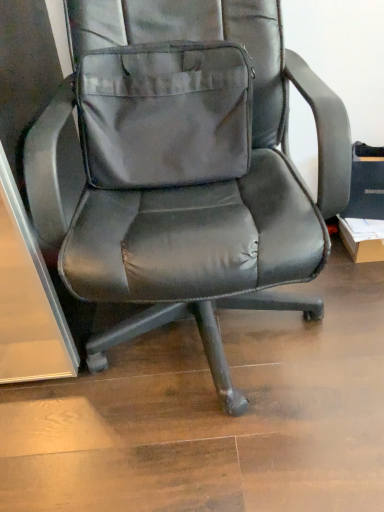
Describe the element at coordinates (165, 114) in the screenshot. I see `gray fabric pocket at center` at that location.

Find the location of a particular element. Image resolution: width=384 pixels, height=512 pixels. gray fabric pocket at center is located at coordinates (165, 114).

I want to click on black leather office chair at center, so click(186, 167).

What is the approximate height of black leather office chair at center?

88.19 centimeters.

The width and height of the screenshot is (384, 512). Describe the element at coordinates (186, 167) in the screenshot. I see `black leather office chair at center` at that location.

Measure the distance between black leather office chair at center and camera.

black leather office chair at center and camera are 31.15 inches apart from each other.

Image resolution: width=384 pixels, height=512 pixels. I want to click on gray fabric pocket at center, so click(x=165, y=114).

Between black leather office chair at center and gray fabric pocket at center, which one appears on the left side from the viewer's perspective?

gray fabric pocket at center is more to the left.

Between black leather office chair at center and gray fabric pocket at center, which one is positioned behind?

Positioned behind is gray fabric pocket at center.

Which is less distant, (185,8) or (166,144)?

Point (185,8) appears to be closer to the viewer than point (166,144).

From the image's perspective, is black leather office chair at center over gray fabric pocket at center?

Actually, black leather office chair at center appears below gray fabric pocket at center in the image.

From a real-world perspective, between black leather office chair at center and gray fabric pocket at center, who is vertically lower?

black leather office chair at center.

In the scene shown: Can you confirm if black leather office chair at center is wider than gray fabric pocket at center?

→ Correct, the width of black leather office chair at center exceeds that of gray fabric pocket at center.

From the picture: Is black leather office chair at center taller than gray fabric pocket at center?

Correct, black leather office chair at center is much taller as gray fabric pocket at center.

Looking at this image, is black leather office chair at center bigger or smaller than gray fabric pocket at center?

Considering their sizes, black leather office chair at center takes up more space than gray fabric pocket at center.

Is black leather office chair at center not inside gray fabric pocket at center?

That's correct, black leather office chair at center is outside of gray fabric pocket at center.

Is black leather office chair at center in contact with gray fabric pocket at center?

Indeed, black leather office chair at center and gray fabric pocket at center are beside each other and touching.

Is black leather office chair at center turned away from gray fabric pocket at center?

Correct, black leather office chair at center is looking away from gray fabric pocket at center.

How many degrees apart are the facing directions of black leather office chair at center and gray fabric pocket at center?

The facing directions of black leather office chair at center and gray fabric pocket at center are 0.00102 degrees apart.

How far apart are black leather office chair at center and gray fabric pocket at center?

black leather office chair at center and gray fabric pocket at center are 2.80 inches apart.

Locate an element on the screen. This screenshot has width=384, height=512. chair in front of the gray fabric pocket at center is located at coordinates (186, 167).

Considering the relative positions of gray fabric pocket at center and black leather office chair at center in the image provided, is gray fabric pocket at center to the right of black leather office chair at center from the viewer's perspective?

In fact, gray fabric pocket at center is to the left of black leather office chair at center.

Is the position of gray fabric pocket at center more distant than that of black leather office chair at center?

Yes.

Is point (105, 115) farther from camera compared to point (145, 169)?

No, it is in front of (145, 169).

From the image's perspective, is gray fabric pocket at center on black leather office chair at center?

Correct, gray fabric pocket at center appears higher than black leather office chair at center in the image.

From a real-world perspective, relative to black leather office chair at center, is gray fabric pocket at center vertically above or below?

In terms of real-world spatial position, gray fabric pocket at center is above black leather office chair at center.

Which of these two, gray fabric pocket at center or black leather office chair at center, is wider?

black leather office chair at center.

Can you confirm if gray fabric pocket at center is taller than black leather office chair at center?

In fact, gray fabric pocket at center may be shorter than black leather office chair at center.

Can you confirm if gray fabric pocket at center is bigger than black leather office chair at center?

No, gray fabric pocket at center is not bigger than black leather office chair at center.

Is gray fabric pocket at center outside of black leather office chair at center?

No, gray fabric pocket at center is not entirely external to black leather office chair at center.

In the scene shown: Are gray fabric pocket at center and black leather office chair at center beside each other?

Yes, gray fabric pocket at center is in contact with black leather office chair at center.

Is gray fabric pocket at center oriented towards black leather office chair at center?

Yes.

What's the angular difference between gray fabric pocket at center and black leather office chair at center's facing directions?

There is a 0.00102-degree angle between the facing directions of gray fabric pocket at center and black leather office chair at center.

How much distance is there between gray fabric pocket at center and black leather office chair at center?

The distance of gray fabric pocket at center from black leather office chair at center is 7.10 centimeters.

Where is `pocket that appears above the black leather office chair at center (from a real-world perspective)`? Image resolution: width=384 pixels, height=512 pixels. pocket that appears above the black leather office chair at center (from a real-world perspective) is located at coordinates (165, 114).

Where is `chair on the right of gray fabric pocket at center`? chair on the right of gray fabric pocket at center is located at coordinates (186, 167).

Where is `pocket behind the black leather office chair at center`? The width and height of the screenshot is (384, 512). pocket behind the black leather office chair at center is located at coordinates (165, 114).